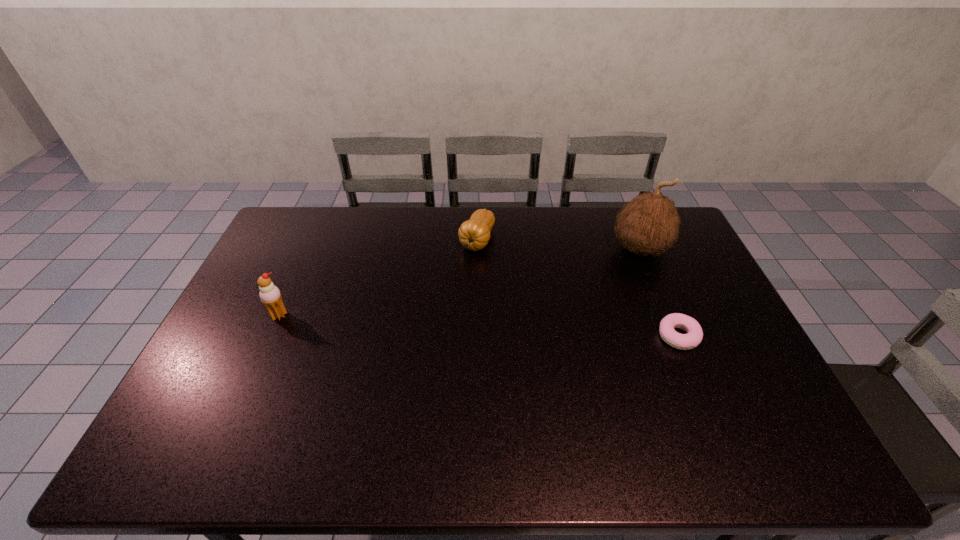
Locate an element on the screen. The height and width of the screenshot is (540, 960). free space on the desktop that is between the icecream and the shortest object and is positioned on the surface of the coconut is located at coordinates (492, 326).

Find the location of a particular element. vacant spot on the desktop that is between the leftmost object and the shortest object and is positioned on the stem side of the third object from right to left is located at coordinates (435, 323).